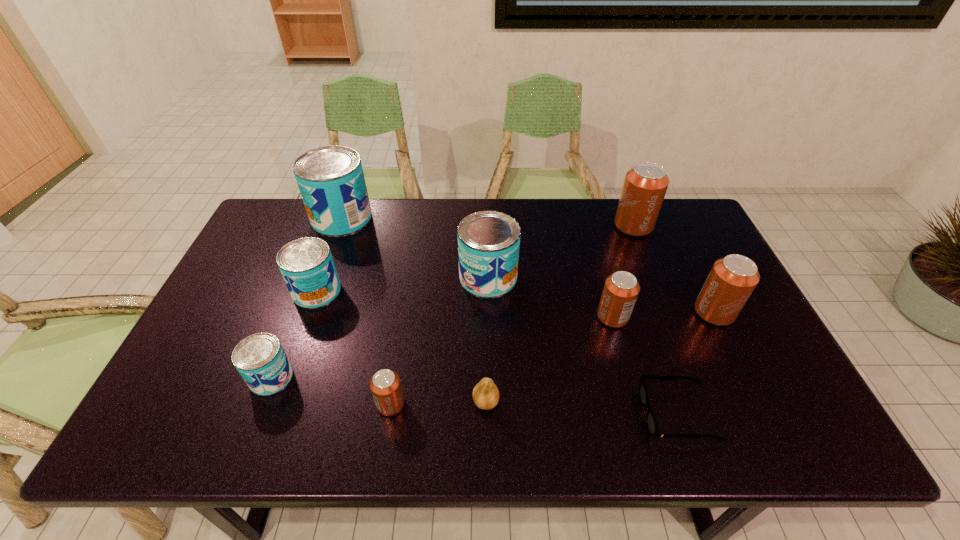
This screenshot has height=540, width=960. Identify the location of spectacles located in the near edge section of the desktop. (651, 422).

I want to click on object that is at the left edge, so click(331, 181).

What are the coordinates of `object that is at the far left corner` in the screenshot? It's located at (331, 181).

The height and width of the screenshot is (540, 960). Identify the location of object located in the far right corner section of the desktop. (645, 185).

The height and width of the screenshot is (540, 960). I want to click on free region at the far edge, so click(526, 211).

Locate an element on the screen. This screenshot has width=960, height=540. blank space at the near edge of the desktop is located at coordinates (292, 420).

The width and height of the screenshot is (960, 540). Find the location of `vacant region at the left edge of the desktop`. vacant region at the left edge of the desktop is located at coordinates (245, 307).

Find the location of a particular element. This screenshot has width=960, height=540. vacant space at the right edge is located at coordinates (751, 319).

The height and width of the screenshot is (540, 960). Find the location of `vacant space at the far left corner of the desktop`. vacant space at the far left corner of the desktop is located at coordinates (262, 231).

Find the location of a particular element. The image size is (960, 540). vacant space at the far right corner of the desktop is located at coordinates (666, 200).